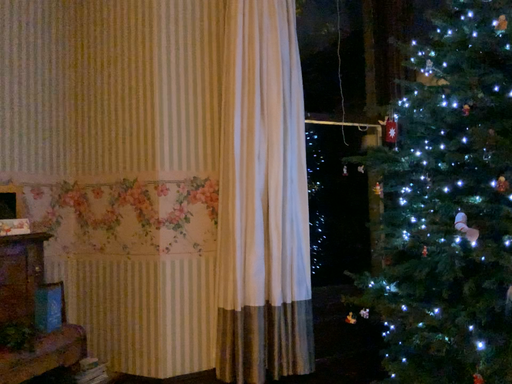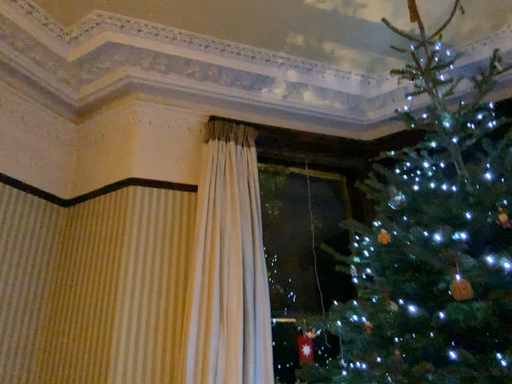
Question: How did the camera likely rotate when shooting the video?

Choices:
 (A) rotated left
 (B) rotated right

Answer: (A)